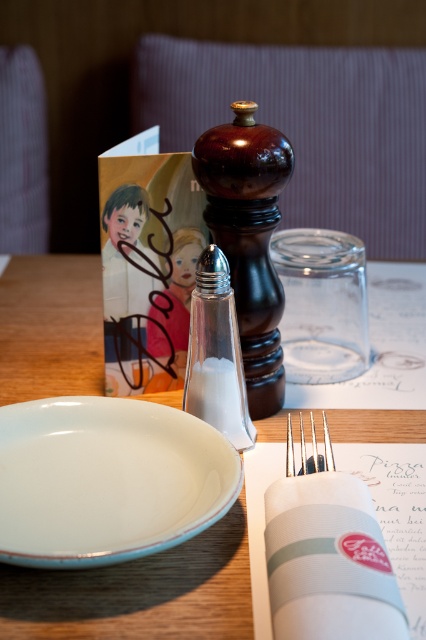
Question: Can you confirm if white glossy platter at lower left is wider than clear glass salt shaker at center?

Choices:
 (A) yes
 (B) no

Answer: (A)

Question: Which of these objects is positioned closest to the satin silver fork at center?

Choices:
 (A) matte ceramic plate at center-left
 (B) white glossy platter at lower left
 (C) clear glass salt shaker at center

Answer: (C)

Question: Does white glossy platter at lower left have a larger size compared to satin silver fork at center?

Choices:
 (A) no
 (B) yes

Answer: (B)

Question: Which is farther from the satin silver fork at center?

Choices:
 (A) matte ceramic plate at center-left
 (B) white glossy platter at lower left

Answer: (A)

Question: Observing the image, what is the correct spatial positioning of white glossy platter at lower left in reference to clear glass salt shaker at center?

Choices:
 (A) left
 (B) right

Answer: (A)

Question: Which object is the closest to the matte ceramic plate at center-left?

Choices:
 (A) clear glass salt shaker at center
 (B) white glossy platter at lower left
 (C) satin silver fork at center

Answer: (B)